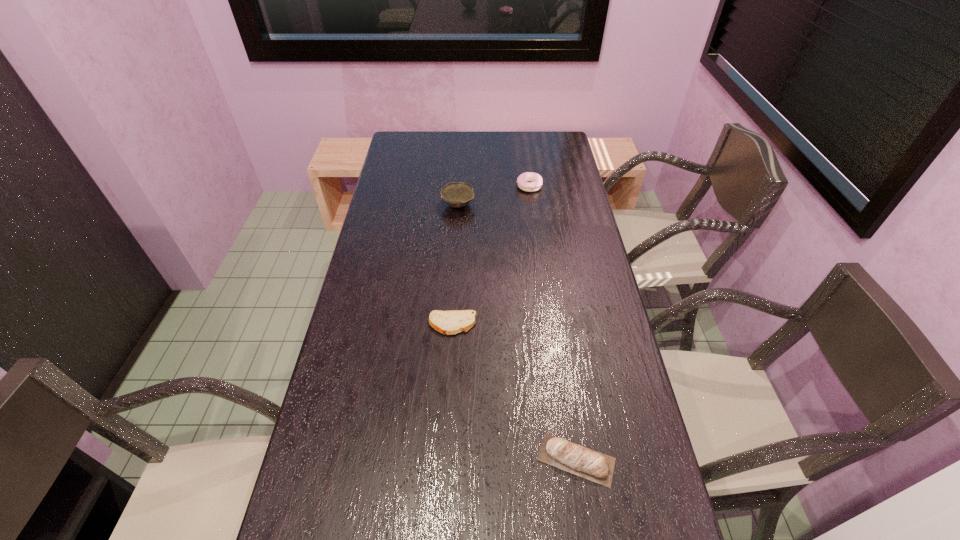
You are a GUI agent. You are given a task and a screenshot of the screen. Output one action in this format:
    pyautogui.click(x=<x>, y=<y>)
    Task: Click on the empty location between the right pita bread and the left pita bread
    This screenshot has width=960, height=540.
    Given the screenshot: What is the action you would take?
    pyautogui.click(x=515, y=392)

Locate an element on the screen. free spot between the nearest object and the second nearest object is located at coordinates (515, 392).

Image resolution: width=960 pixels, height=540 pixels. What are the coordinates of `empty location between the right pita bread and the farthest object` in the screenshot? It's located at (553, 323).

Locate an element on the screen. Image resolution: width=960 pixels, height=540 pixels. empty space between the nearest object and the third nearest object is located at coordinates (517, 332).

Find the location of `vacant point located between the shorter pita bread and the nearer pita bread`. vacant point located between the shorter pita bread and the nearer pita bread is located at coordinates (515, 392).

At what (x,y) coordinates should I click in order to perform the action: click on vacant area between the farthest object and the left pita bread. Please return your answer as a coordinate pair (x, y). The width and height of the screenshot is (960, 540). Looking at the image, I should click on (x=492, y=255).

The height and width of the screenshot is (540, 960). In order to click on blank region between the right pita bread and the bowl in this screenshot , I will do `click(517, 332)`.

This screenshot has width=960, height=540. Find the location of `object that stands as the second closest to the nearer pita bread`. object that stands as the second closest to the nearer pita bread is located at coordinates (456, 194).

Locate an element on the screen. The image size is (960, 540). object that is the third nearest to the farthest object is located at coordinates (584, 462).

At what (x,y) coordinates should I click in order to perform the action: click on free space that satisfies the following two spatial constraints: 1. on the front side of the farthest object; 2. on the right side of the taller pita bread. Please return your answer as a coordinate pair (x, y). Image resolution: width=960 pixels, height=540 pixels. Looking at the image, I should click on (566, 460).